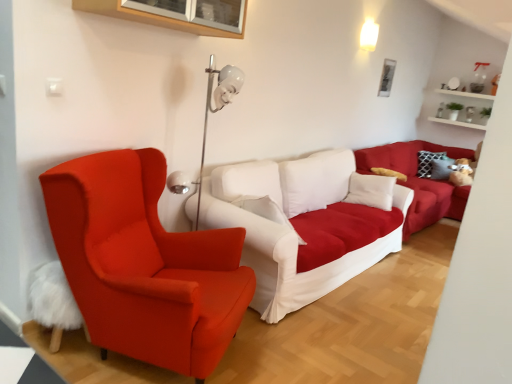
In order to face white fabric couch at center, the 2th studio couch viewed from the back, should I rotate leftwards or rightwards?

You should look right and rotate roughly 8.168 degrees.

Locate an element on the screen. matte white wall sconce at upper right is located at coordinates (369, 35).

What do you see at coordinates (144, 264) in the screenshot? This screenshot has width=512, height=384. I see `matte orange armchair at left` at bounding box center [144, 264].

Locate an element on the screen. white fabric couch at center, acting as the 2th studio couch starting from the front is located at coordinates (418, 181).

From a real-world perspective, which object stands above the other?

white wooden shelf at upper right is physically above.

Considering the relative positions of white wooden shelf at upper right and white fabric couch at center, the 1th studio couch from the back, in the image provided, is white wooden shelf at upper right to the left of white fabric couch at center, the 1th studio couch from the back, from the viewer's perspective?

No.

From the image's perspective, does white wooden shelf at upper right appear lower than white fabric couch at center, the 1th studio couch from the back?

No.

Looking at their sizes, would you say white wooden shelf at upper right is wider or thinner than white fabric couch at center, acting as the 2th studio couch starting from the front?

Clearly, white wooden shelf at upper right has less width compared to white fabric couch at center, acting as the 2th studio couch starting from the front.

Does white fabric couch at center, the 1th studio couch from the back, have a larger size compared to white wooden shelf at upper right?

Yes.

Which object is further away from the camera taking this photo, white fabric couch at center, the 1th studio couch from the back, or white wooden shelf at upper right?

white wooden shelf at upper right is more distant.

Is white fabric couch at center, acting as the 2th studio couch starting from the front, in contact with white wooden shelf at upper right?

white fabric couch at center, acting as the 2th studio couch starting from the front, and white wooden shelf at upper right are clearly separated.

Does white fabric couch at center, the 1th studio couch from the back, turn towards white wooden shelf at upper right?

No, white fabric couch at center, the 1th studio couch from the back, is not aimed at white wooden shelf at upper right.

Does white fabric couch at center, acting as the 2th studio couch starting from the front, have a lesser width compared to matte orange armchair at left?

In fact, white fabric couch at center, acting as the 2th studio couch starting from the front, might be wider than matte orange armchair at left.

From a real-world perspective, does white fabric couch at center, the 1th studio couch from the back, stand above matte orange armchair at left?

No, from a real-world perspective, white fabric couch at center, the 1th studio couch from the back, is not on top of matte orange armchair at left.

Considering their positions, is white fabric couch at center, the 1th studio couch from the back, located in front of or behind matte orange armchair at left?

white fabric couch at center, the 1th studio couch from the back, is positioned farther from the viewer than matte orange armchair at left.

Considering the sizes of white wooden shelf at upper right and white fabric couch at center, which ranks as the first studio couch in front-to-back order, in the image, is white wooden shelf at upper right wider or thinner than white fabric couch at center, which ranks as the first studio couch in front-to-back order,?

Clearly, white wooden shelf at upper right has less width compared to white fabric couch at center, which ranks as the first studio couch in front-to-back order.

At what (x,y) coordinates should I click in order to perform the action: click on shelf positioned vertically above the white fabric couch at center, the 2th studio couch viewed from the back (from a real-world perspective). Please return your answer as a coordinate pair (x, y). Looking at the image, I should click on (465, 94).

From a real-world perspective, between white wooden shelf at upper right and white fabric couch at center, which ranks as the first studio couch in front-to-back order, who is vertically lower?

From a 3D spatial view, white fabric couch at center, which ranks as the first studio couch in front-to-back order, is below.

Is white wooden shelf at upper right situated inside white fabric couch at center, the 2th studio couch viewed from the back, or outside?

white wooden shelf at upper right is outside white fabric couch at center, the 2th studio couch viewed from the back.

Relative to white fabric couch at center, the 2th studio couch viewed from the back, is matte orange armchair at left in front or behind?

Clearly, matte orange armchair at left is in front of white fabric couch at center, the 2th studio couch viewed from the back.

In the scene shown: Does matte orange armchair at left have a smaller size compared to white fabric couch at center, which ranks as the first studio couch in front-to-back order?

Correct, matte orange armchair at left occupies less space than white fabric couch at center, which ranks as the first studio couch in front-to-back order.

Can you tell me how much matte orange armchair at left and white fabric couch at center, which ranks as the first studio couch in front-to-back order, differ in facing direction?

The facing directions of matte orange armchair at left and white fabric couch at center, which ranks as the first studio couch in front-to-back order, are 27.6 degrees apart.

Is matte orange armchair at left at the left side of white fabric couch at center, which ranks as the first studio couch in front-to-back order?

Indeed, matte orange armchair at left is positioned on the left side of white fabric couch at center, which ranks as the first studio couch in front-to-back order.

Consider the image. Measure the distance from white fabric couch at center, the 2th studio couch viewed from the back, to metallic silver picture frame at upper center.

The distance of white fabric couch at center, the 2th studio couch viewed from the back, from metallic silver picture frame at upper center is 7.59 feet.

Is white fabric couch at center, the 2th studio couch viewed from the back, in front of metallic silver picture frame at upper center?

Yes, it is in front of metallic silver picture frame at upper center.

Is white fabric couch at center, the 2th studio couch viewed from the back, smaller than metallic silver picture frame at upper center?

No, white fabric couch at center, the 2th studio couch viewed from the back, is not smaller than metallic silver picture frame at upper center.

Who is taller, white fabric couch at center, which ranks as the first studio couch in front-to-back order, or metallic silver picture frame at upper center?

white fabric couch at center, which ranks as the first studio couch in front-to-back order, is taller.

Is white fabric couch at center, acting as the 2th studio couch starting from the front, beside matte white wall sconce at upper right?

No.

Is matte white wall sconce at upper right at the back of white fabric couch at center, the 1th studio couch from the back?

No, white fabric couch at center, the 1th studio couch from the back,'s orientation is not away from matte white wall sconce at upper right.

From a real-world perspective, is white fabric couch at center, the 1th studio couch from the back, beneath matte white wall sconce at upper right?

Correct, in the physical world, white fabric couch at center, the 1th studio couch from the back, is lower than matte white wall sconce at upper right.

Is white fabric couch at center, the 1th studio couch from the back, positioned in front of matte white wall sconce at upper right?

Yes, it is in front of matte white wall sconce at upper right.

Locate an element on the screen. The height and width of the screenshot is (384, 512). shelf that appears on the right of white fabric couch at center, acting as the 2th studio couch starting from the front is located at coordinates (465, 94).

At what (x,y) coordinates should I click in order to perform the action: click on studio couch that is the 1st one when counting leftward from the white wooden shelf at upper right. Please return your answer as a coordinate pair (x, y). The image size is (512, 384). Looking at the image, I should click on pos(418,181).

Estimate the real-world distances between objects in this image. Which object is further from white wooden shelf at upper right, matte orange armchair at left or white fabric couch at center, the 2th studio couch viewed from the back?

Among the two, matte orange armchair at left is located further to white wooden shelf at upper right.

Estimate the real-world distances between objects in this image. Which object is further from white wooden shelf at upper right, white fabric couch at center, acting as the 2th studio couch starting from the front, or matte white wall sconce at upper right?

Based on the image, matte white wall sconce at upper right appears to be further to white wooden shelf at upper right.

Looking at the image, which one is located closer to matte white wall sconce at upper right, metallic silver picture frame at upper center or white fabric couch at center, the 1th studio couch from the back?

metallic silver picture frame at upper center is closer to matte white wall sconce at upper right.

Based on their spatial positions, is matte white wall sconce at upper right or white wooden shelf at upper right further from metallic silver picture frame at upper center?

white wooden shelf at upper right is further to metallic silver picture frame at upper center.

In the scene shown: Based on their spatial positions, is matte orange armchair at left or white wooden shelf at upper right closer to white fabric couch at center, which ranks as the first studio couch in front-to-back order?

matte orange armchair at left lies closer to white fabric couch at center, which ranks as the first studio couch in front-to-back order, than the other object.

Estimate the real-world distances between objects in this image. Which object is further from white fabric couch at center, the 1th studio couch from the back, metallic silver picture frame at upper center or white wooden shelf at upper right?

white wooden shelf at upper right is positioned further to the anchor white fabric couch at center, the 1th studio couch from the back.

When comparing their distances from white fabric couch at center, acting as the 2th studio couch starting from the front, does white fabric couch at center, which ranks as the first studio couch in front-to-back order, or metallic silver picture frame at upper center seem closer?

white fabric couch at center, which ranks as the first studio couch in front-to-back order, lies closer to white fabric couch at center, acting as the 2th studio couch starting from the front, than the other object.

Considering their positions, is white fabric couch at center, acting as the 2th studio couch starting from the front, positioned closer to matte orange armchair at left than matte white wall sconce at upper right?

white fabric couch at center, acting as the 2th studio couch starting from the front.

This screenshot has height=384, width=512. Find the location of `light fixture positioned between white fabric couch at center, which ranks as the first studio couch in front-to-back order, and white wooden shelf at upper right from near to far`. light fixture positioned between white fabric couch at center, which ranks as the first studio couch in front-to-back order, and white wooden shelf at upper right from near to far is located at coordinates (369, 35).

At what (x,y) coordinates should I click in order to perform the action: click on studio couch between matte white wall sconce at upper right and white wooden shelf at upper right. Please return your answer as a coordinate pair (x, y). The image size is (512, 384). Looking at the image, I should click on (418, 181).

Locate an element on the screen. The width and height of the screenshot is (512, 384). picture frame located between matte orange armchair at left and white wooden shelf at upper right in the depth direction is located at coordinates (386, 78).

Find the location of a particular element. The image size is (512, 384). studio couch located between white fabric couch at center, the 2th studio couch viewed from the back, and matte white wall sconce at upper right in the depth direction is located at coordinates (418, 181).